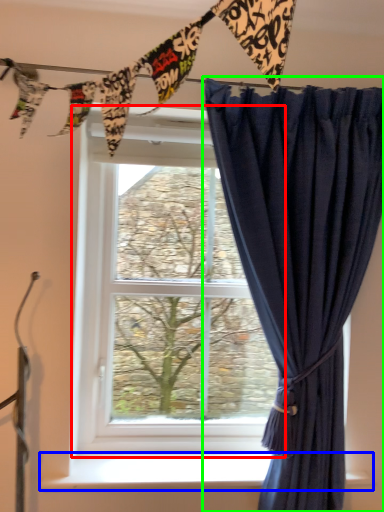
Question: Which object is positioned closest to window (highlighted by a red box)? Select from window sill (highlighted by a blue box) and curtain (highlighted by a green box).

Choices:
 (A) window sill
 (B) curtain

Answer: (B)